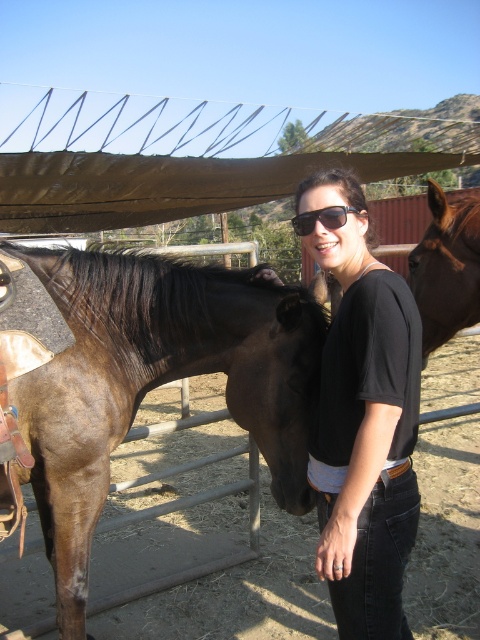
You are a photographer trying to capture both the brown glossy horse at left and the brown glossy horse at right in a single frame. Given that your camera has a fixed focal length and you can only adjust your position, which horse should you move closer to in order to include both in the frame without cropping?

You should move closer to the brown glossy horse at right because it is smaller than the brown glossy horse at left. By moving closer to the smaller horse, you can ensure both horses fit within the camera frame while maintaining their relative sizes.

You are a photographer positioned at the center of the scene. You want to take a photo of the brown glossy horse at left. Which direction should you move to get the horse centered in your view?

The brown glossy horse at left is located at point 0.598 on the x and 0.325 on the y. Since you are at the center, which is 0.5 on both axes, you need to move to the right to align with the horse along the x axis and slightly up along the y axis to center it in your view.

Looking at this image, you are a photographer standing at the center of the scene. You want to take a photo of the black cotton shirt at center and the brown glossy horse at right in the same frame. The camera has a maximum focus range of 18 inches. Will both objects be in focus?

The black cotton shirt at center and brown glossy horse at right are 17.65 inches apart, which is within the camera maximum focus range of 18 inches. Therefore, both objects will be in focus.